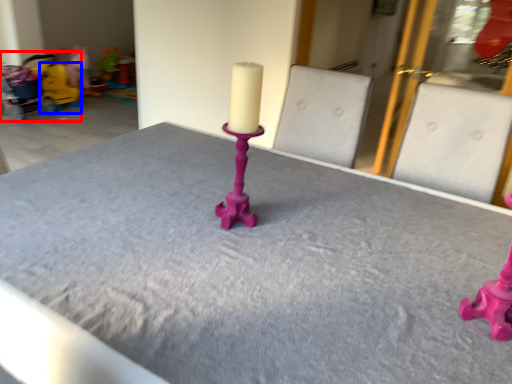
Question: Which of the following is the farthest to the observer, baby carriage (highlighted by a red box) or toy (highlighted by a blue box)?

Choices:
 (A) baby carriage
 (B) toy

Answer: (B)